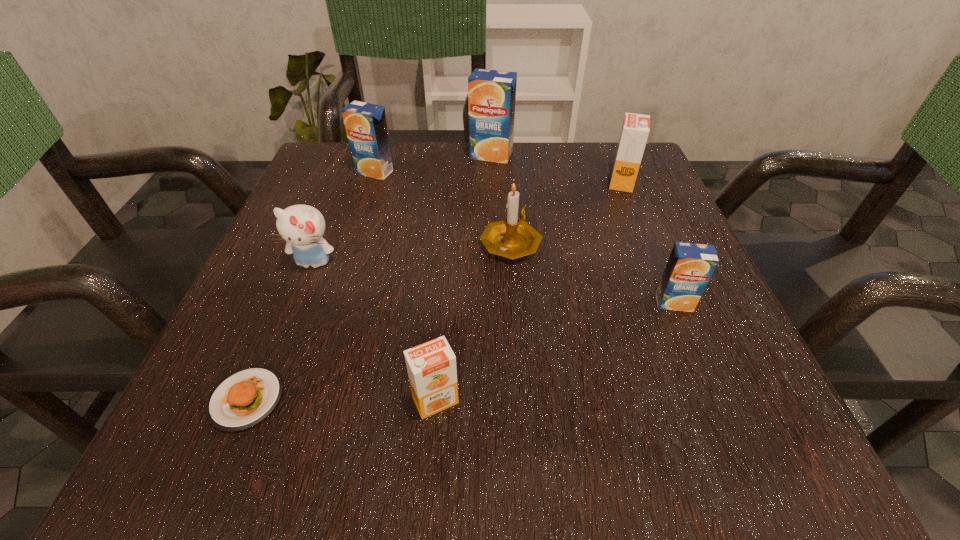
Find the location of a particular element. This screenshot has height=540, width=960. vacant area between the bigger orange orange juice and the biggest blue orange_juice is located at coordinates (557, 168).

You are a GUI agent. You are given a task and a screenshot of the screen. Output one action in this format:
    pyautogui.click(x=<x>, y=<y>)
    Task: Click on the empty space between the shortest object and the leftmost blue orange_juice
    This screenshot has width=960, height=540.
    Given the screenshot: What is the action you would take?
    pyautogui.click(x=311, y=286)

Locate an element on the screen. unoccupied area between the fifth object from right to left and the farther orange orange juice is located at coordinates (529, 291).

At what (x,y) coordinates should I click in order to perform the action: click on free space between the fourth orange juice from right to left and the food. Please return your answer as a coordinate pair (x, y). Image resolution: width=960 pixels, height=540 pixels. Looking at the image, I should click on (341, 400).

This screenshot has width=960, height=540. I want to click on the closest object relative to the sixth farthest object, so pos(513,238).

I want to click on object that is the fourth closest to the kitten, so click(431, 366).

I want to click on orange juice that can be found as the third closest to the bigger orange orange juice, so click(366, 127).

The width and height of the screenshot is (960, 540). Find the location of `orange juice that is the fourth closest one to the right orange orange juice`. orange juice that is the fourth closest one to the right orange orange juice is located at coordinates (431, 366).

Find the location of a particular element. blue orange_juice that is the third closest to the food is located at coordinates (491, 93).

Select which blue orange_juice is the second closest to the smallest blue orange_juice. Please provide its 2D coordinates. Your answer should be formatted as a tuple, i.e. [(x, y)], where the tuple contains the x and y coordinates of a point satisfying the conditions above.

[(366, 127)]